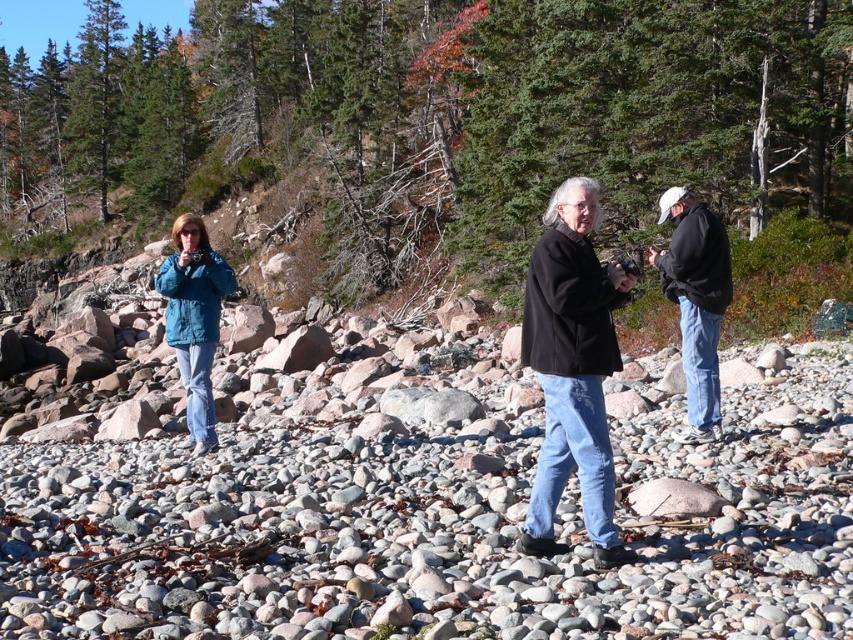
Question: Is black matte jacket at center bigger than black matte jacket at right?

Choices:
 (A) no
 (B) yes

Answer: (B)

Question: Which object is farther from the camera taking this photo?

Choices:
 (A) black matte jacket at right
 (B) teal matte jacket at left

Answer: (B)

Question: Does black matte jacket at center appear over teal matte jacket at left?

Choices:
 (A) yes
 (B) no

Answer: (A)

Question: Is black matte jacket at center closer to the viewer compared to black matte jacket at right?

Choices:
 (A) yes
 (B) no

Answer: (A)

Question: Which point appears closest to the camera in this image?

Choices:
 (A) (215, 310)
 (B) (590, 326)
 (C) (718, 404)

Answer: (B)

Question: Among these points, which one is nearest to the camera?

Choices:
 (A) [x=193, y=244]
 (B) [x=709, y=440]

Answer: (B)